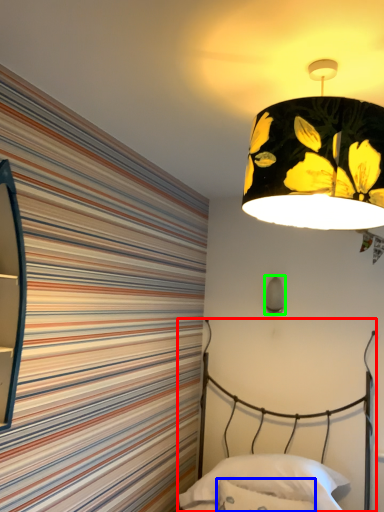
Question: Which object is the farthest from bed (highlighted by a red box)? Choose among these: throw pillow (highlighted by a blue box) or lamp (highlighted by a green box).

Choices:
 (A) throw pillow
 (B) lamp

Answer: (B)